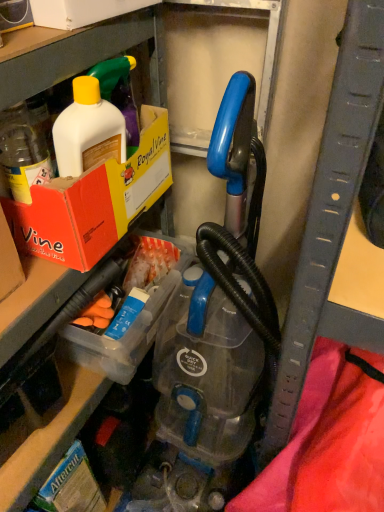
What do you see at coordinates (94, 201) in the screenshot? Image resolution: width=384 pixels, height=512 pixels. I see `orange cardboard box at upper left` at bounding box center [94, 201].

The width and height of the screenshot is (384, 512). What are the coordinates of `orange cardboard box at upper left` in the screenshot? It's located at (94, 201).

What do you see at coordinates (132, 323) in the screenshot?
I see `clear plastic container at center` at bounding box center [132, 323].

Measure the distance between clear plastic container at center and camera.

The depth of clear plastic container at center is 30.02 inches.

Image resolution: width=384 pixels, height=512 pixels. Identify the location of clear plastic container at center. (132, 323).

Locate an element on the screen. orange cardboard box at upper left is located at coordinates (94, 201).

Does clear plastic container at center appear on the left side of orange cardboard box at upper left?

No, clear plastic container at center is not to the left of orange cardboard box at upper left.

Is clear plastic container at center in front of or behind orange cardboard box at upper left in the image?

clear plastic container at center is positioned farther from the viewer than orange cardboard box at upper left.

Considering the points (76, 352) and (23, 210), which point is in front, point (76, 352) or point (23, 210)?

Positioned in front is point (23, 210).

From the image's perspective, is clear plastic container at center on orange cardboard box at upper left?

Actually, clear plastic container at center appears below orange cardboard box at upper left in the image.

From a real-world perspective, between clear plastic container at center and orange cardboard box at upper left, who is vertically higher?

orange cardboard box at upper left, from a real-world perspective.

Considering the relative sizes of clear plastic container at center and orange cardboard box at upper left in the image provided, is clear plastic container at center thinner than orange cardboard box at upper left?

Incorrect, the width of clear plastic container at center is not less than that of orange cardboard box at upper left.

Does clear plastic container at center have a greater height compared to orange cardboard box at upper left?

No, clear plastic container at center is not taller than orange cardboard box at upper left.

Does clear plastic container at center have a smaller size compared to orange cardboard box at upper left?

Yes, clear plastic container at center is smaller than orange cardboard box at upper left.

Is orange cardboard box at upper left a part of clear plastic container at center?

Definitely not — orange cardboard box at upper left is not inside clear plastic container at center.

From the picture: Are clear plastic container at center and orange cardboard box at upper left located far from each other?

No, there isn't a large distance between clear plastic container at center and orange cardboard box at upper left.

In the scene shown: Is clear plastic container at center aimed at orange cardboard box at upper left?

No, clear plastic container at center is not oriented towards orange cardboard box at upper left.

How far apart are clear plastic container at center and orange cardboard box at upper left?

The distance of clear plastic container at center from orange cardboard box at upper left is 8.78 inches.

You are a GUI agent. You are given a task and a screenshot of the screen. Output one action in this format:
    pyautogui.click(x=<x>, y=<y>)
    Task: Click on the storage box on the right of the orange cardboard box at upper left
    The height and width of the screenshot is (512, 384).
    Given the screenshot: What is the action you would take?
    pyautogui.click(x=132, y=323)

Which is more to the left, orange cardboard box at upper left or clear plastic container at center?

orange cardboard box at upper left.

Which is in front, orange cardboard box at upper left or clear plastic container at center?

Positioned in front is orange cardboard box at upper left.

Does point (103, 241) lie in front of point (71, 337)?

Yes, it is in front of point (71, 337).

Looking at this image, from the image's perspective, relative to clear plastic container at center, is orange cardboard box at upper left above or below?

From the image's perspective, orange cardboard box at upper left appears above clear plastic container at center.

Based on the photo, from a real-world perspective, which is physically below, orange cardboard box at upper left or clear plastic container at center?

clear plastic container at center, from a real-world perspective.

Is orange cardboard box at upper left wider than clear plastic container at center?

Incorrect, the width of orange cardboard box at upper left does not surpass that of clear plastic container at center.

Considering the relative sizes of orange cardboard box at upper left and clear plastic container at center in the image provided, is orange cardboard box at upper left taller than clear plastic container at center?

Yes, orange cardboard box at upper left is taller than clear plastic container at center.

Considering the relative sizes of orange cardboard box at upper left and clear plastic container at center in the image provided, is orange cardboard box at upper left bigger than clear plastic container at center?

Indeed, orange cardboard box at upper left has a larger size compared to clear plastic container at center.

Is clear plastic container at center a part of orange cardboard box at upper left?

No, clear plastic container at center is not inside orange cardboard box at upper left.

Is there a large distance between orange cardboard box at upper left and clear plastic container at center?

No, orange cardboard box at upper left is not far away from clear plastic container at center.

Is orange cardboard box at upper left facing towards clear plastic container at center?

No, orange cardboard box at upper left is not turned towards clear plastic container at center.

This screenshot has width=384, height=512. In order to click on storage box that is under the orange cardboard box at upper left (from a real-world perspective) in this screenshot , I will do `click(132, 323)`.

I want to click on box above the clear plastic container at center (from the image's perspective), so click(x=94, y=201).

Image resolution: width=384 pixels, height=512 pixels. I want to click on storage box on the right of orange cardboard box at upper left, so click(x=132, y=323).